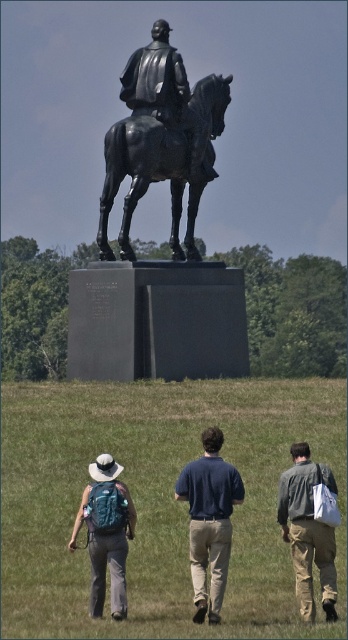
Can you confirm if green grass at lower center is wider than dark blue shirt at center?

Correct, the width of green grass at lower center exceeds that of dark blue shirt at center.

Between green grass at lower center and dark blue shirt at center, which one has less height?

dark blue shirt at center is shorter.

Between point (97, 404) and point (225, 564), which one is positioned in front?

Point (225, 564) is more forward.

The width and height of the screenshot is (348, 640). I want to click on green grass at lower center, so click(x=160, y=500).

Is bronze statue at center to the right of denim jacket at lower right from the viewer's perspective?

No, bronze statue at center is not to the right of denim jacket at lower right.

Does bronze statue at center appear on the left side of denim jacket at lower right?

Correct, you'll find bronze statue at center to the left of denim jacket at lower right.

Is point (226, 90) positioned behind point (295, 561)?

Yes, it is.

This screenshot has width=348, height=640. Identify the location of bronze statue at center. coord(162,140).

Is green grass at lower center closer to the viewer compared to denim jacket at lower right?

Yes, it is.

Does green grass at lower center appear under denim jacket at lower right?

Correct, green grass at lower center is located below denim jacket at lower right.

Is point (28, 388) positioned behind point (298, 513)?

Yes, point (28, 388) is behind point (298, 513).

Locate an element on the screen. green grass at lower center is located at coordinates (160, 500).